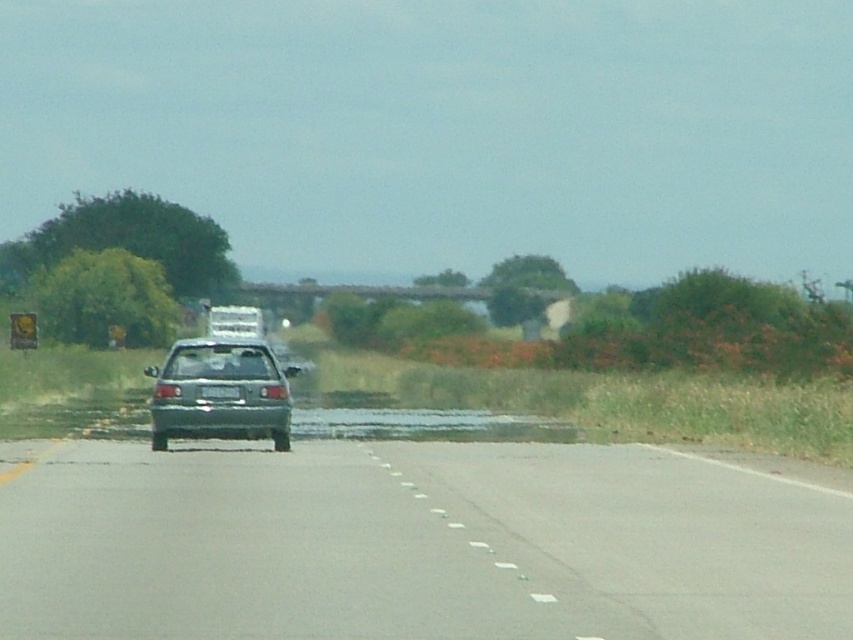
Question: Is gray asphalt highway at center above metallic gray hatchback at center?

Choices:
 (A) no
 (B) yes

Answer: (A)

Question: Which of these objects is positioned closest to the metallic gray hatchback at center?

Choices:
 (A) white plastic license plate at center
 (B) gray asphalt flood at center
 (C) gray asphalt highway at center

Answer: (A)

Question: Does gray asphalt highway at center have a smaller size compared to metallic gray hatchback at center?

Choices:
 (A) yes
 (B) no

Answer: (A)

Question: Which object is positioned farthest from the gray asphalt flood at center?

Choices:
 (A) gray asphalt highway at center
 (B) metallic gray hatchback at center

Answer: (B)

Question: Among these objects, which one is nearest to the camera?

Choices:
 (A) gray asphalt highway at center
 (B) metallic gray hatchback at center
 (C) white plastic license plate at center

Answer: (A)

Question: Does gray asphalt flood at center have a smaller size compared to white plastic license plate at center?

Choices:
 (A) yes
 (B) no

Answer: (B)